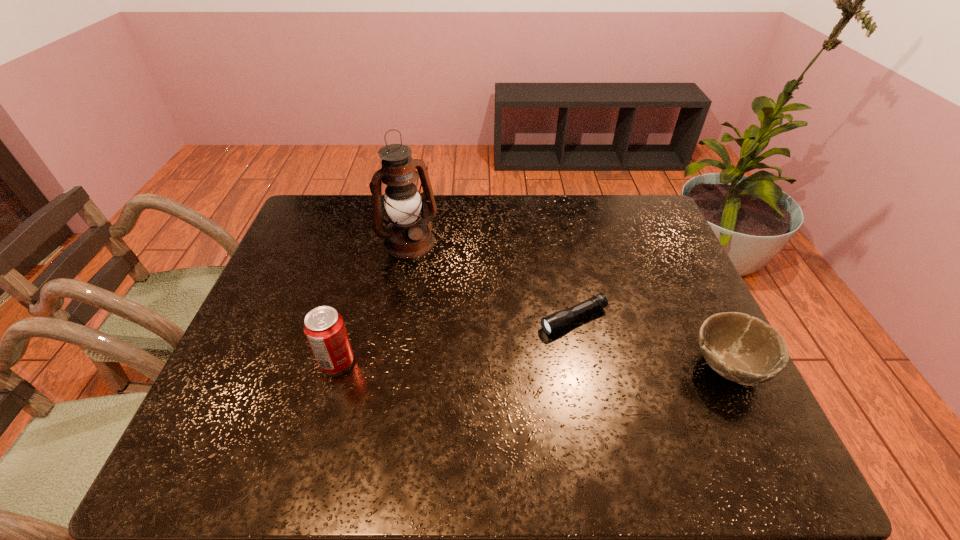
Identify the location of vacant space at the near edge of the desktop. (390, 423).

Find the location of a particular element. The height and width of the screenshot is (540, 960). free location at the left edge of the desktop is located at coordinates (246, 330).

Where is `vacant space at the right edge of the desktop`? vacant space at the right edge of the desktop is located at coordinates point(661,335).

Identify the location of free space at the far left corner of the desktop. The image size is (960, 540). (301, 226).

The height and width of the screenshot is (540, 960). I want to click on free space at the far right corner of the desktop, so click(x=646, y=235).

Image resolution: width=960 pixels, height=540 pixels. Identify the location of free point between the farthest object and the flashlight. (491, 280).

The height and width of the screenshot is (540, 960). What are the coordinates of `free space between the flashlight and the tallest object` in the screenshot? It's located at (491, 280).

At what (x,y) coordinates should I click in order to perform the action: click on vacant area that lies between the rightmost object and the lantern. Please return your answer as a coordinate pair (x, y). This screenshot has width=960, height=540. Looking at the image, I should click on (568, 305).

What are the coordinates of `vacant area that lies between the second tallest object and the lantern` in the screenshot? It's located at (372, 302).

Find the location of a particular element. The height and width of the screenshot is (540, 960). empty space that is in between the soda and the flashlight is located at coordinates (455, 341).